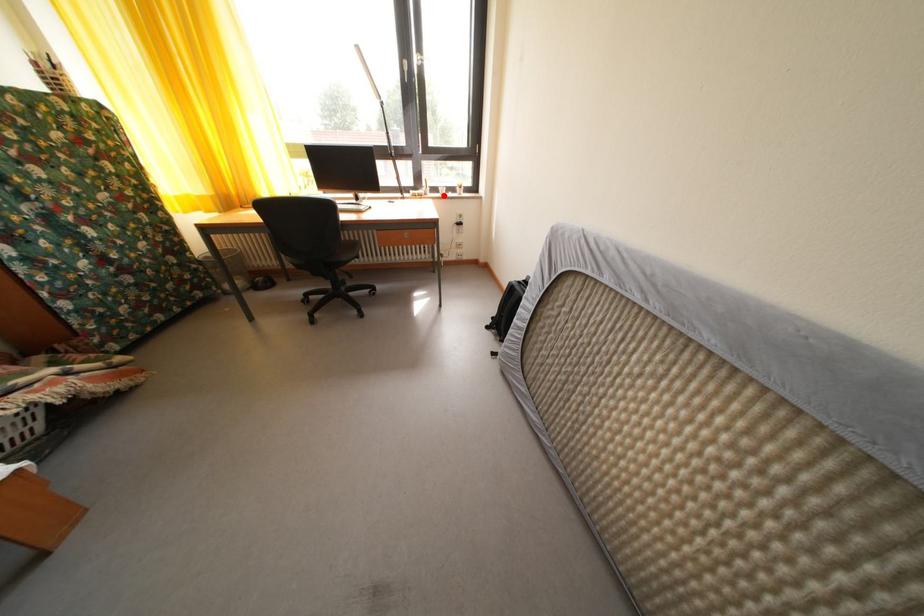
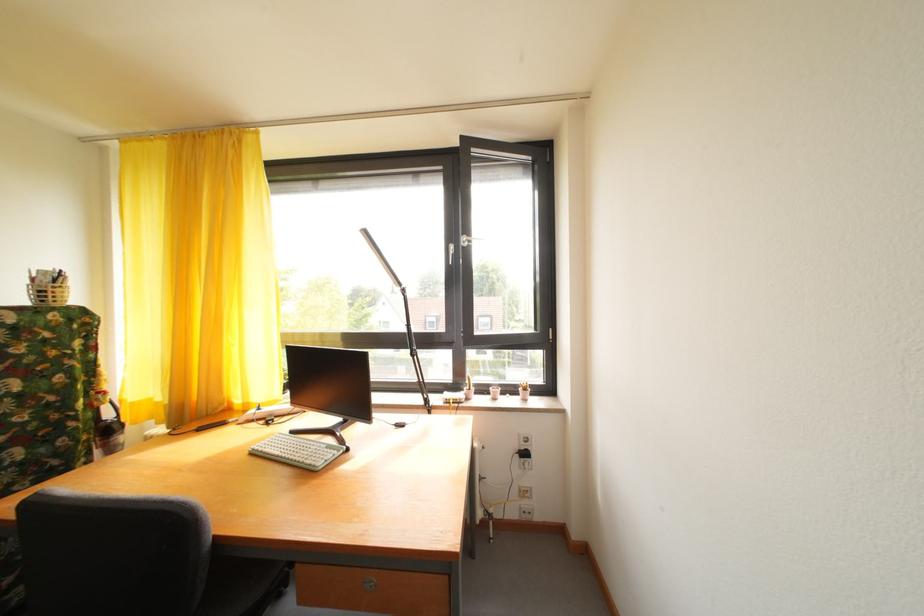
Locate, in the second image, the point that corresponds to the highlighted location in the first image.

(492, 395)